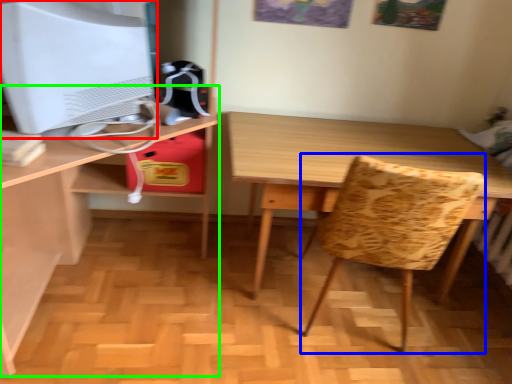
Question: Which object is positioned farthest from computer monitor (highlighted by a red box)? Select from swivel chair (highlighted by a blue box) and desk (highlighted by a green box).

Choices:
 (A) swivel chair
 (B) desk

Answer: (A)